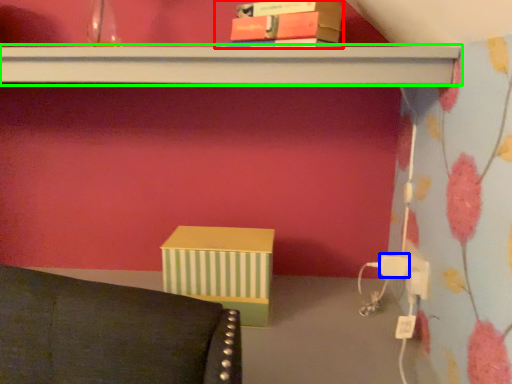
Question: Based on their relative distances, which object is farther from book (highlighted by a red box)? Choose from plug (highlighted by a blue box) and shelf (highlighted by a green box).

Choices:
 (A) plug
 (B) shelf

Answer: (A)